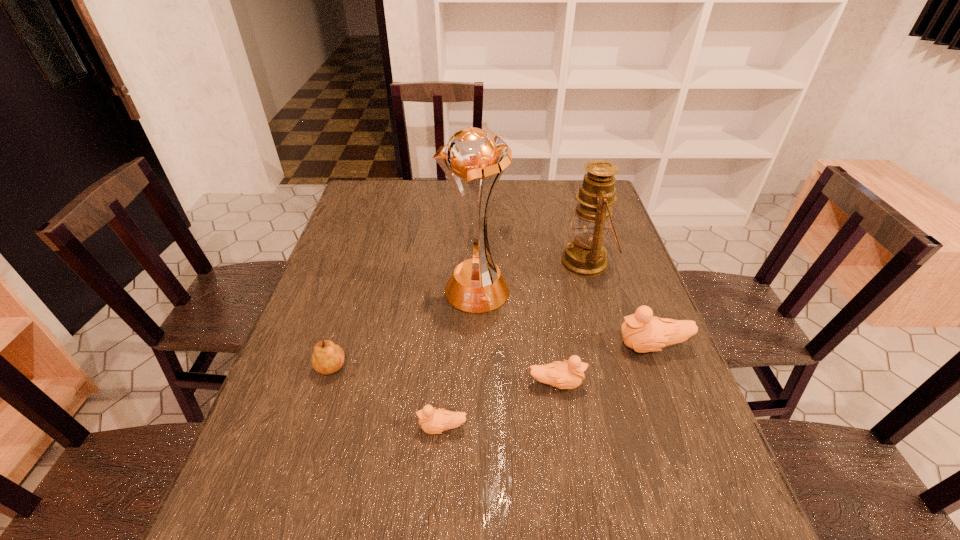
Locate an element on the screen. The height and width of the screenshot is (540, 960). the nearest object is located at coordinates (433, 421).

Where is `the leftmost duckling`? This screenshot has height=540, width=960. the leftmost duckling is located at coordinates (433, 421).

Identify the location of the second duckling from left to right. The width and height of the screenshot is (960, 540). (564, 375).

Find the location of a particular element. The height and width of the screenshot is (540, 960). the second shortest duckling is located at coordinates (564, 375).

Where is `the tallest duckling`? the tallest duckling is located at coordinates (642, 332).

At what (x,y) coordinates should I click in order to perform the action: click on the farthest duckling. Please return your answer as a coordinate pair (x, y). Looking at the image, I should click on (642, 332).

Identify the location of the leftmost object. The height and width of the screenshot is (540, 960). (328, 357).

At what (x,y) coordinates should I click in order to perform the action: click on trophy. Please return your answer as a coordinate pair (x, y). The height and width of the screenshot is (540, 960). Looking at the image, I should click on (477, 285).

The image size is (960, 540). What are the coordinates of `the fifth shortest object` in the screenshot? It's located at (585, 255).

What are the coordinates of `vacant region located on the face of the nearest duckling` in the screenshot? It's located at (375, 428).